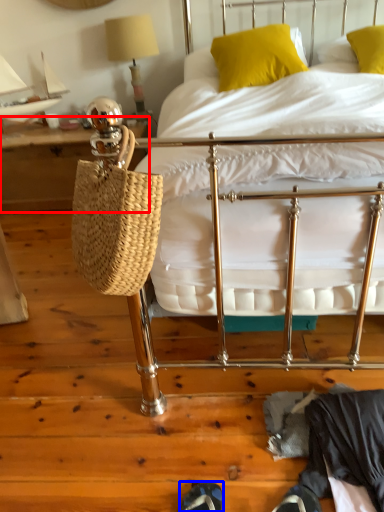
Question: Which of the following is the closest to the observer, table (highlighted by a red box) or shoe (highlighted by a blue box)?

Choices:
 (A) table
 (B) shoe

Answer: (B)